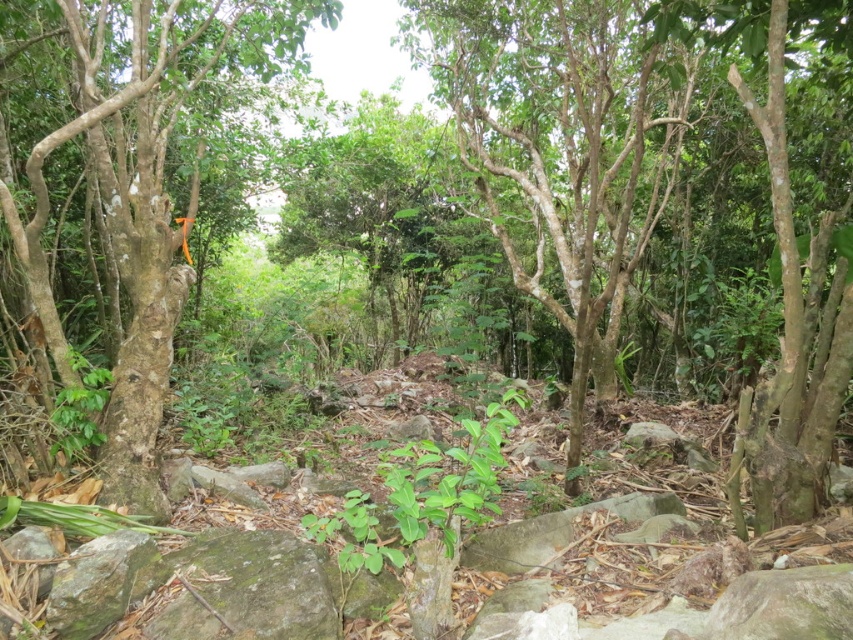
Is smooth bark tree at center positioned in front of green rough bark tree at left?

No, smooth bark tree at center is further to the viewer.

Find the location of `smooth bark tree at center`. smooth bark tree at center is located at coordinates (560, 148).